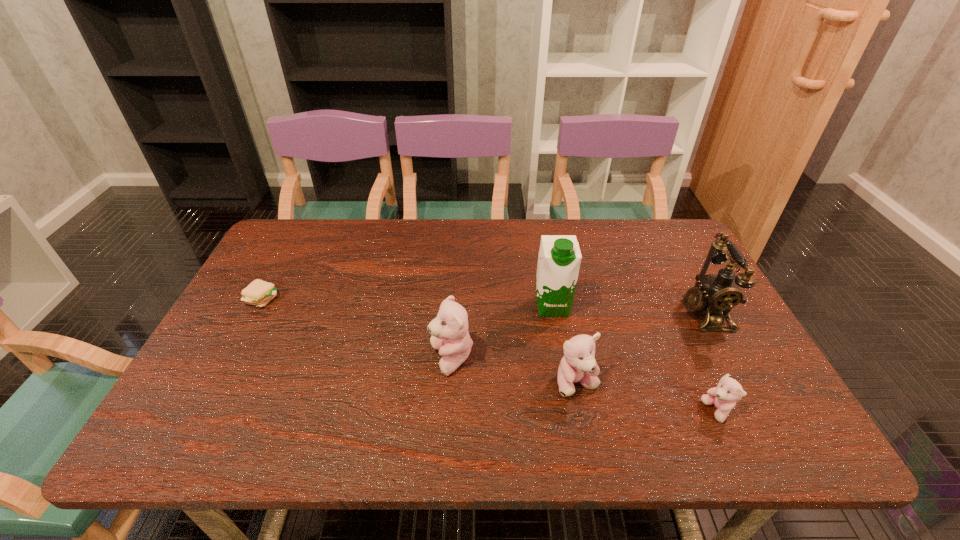
Where is `the leftmost teddy bear`? This screenshot has height=540, width=960. the leftmost teddy bear is located at coordinates (449, 330).

At what (x,y) coordinates should I click in order to perform the action: click on the second teddy bear from right to left. Please return your answer as a coordinate pair (x, y). Looking at the image, I should click on (578, 365).

At what (x,y) coordinates should I click in order to perform the action: click on the second tallest teddy bear. Please return your answer as a coordinate pair (x, y). This screenshot has width=960, height=540. Looking at the image, I should click on (578, 365).

Find the location of `the shortest teddy bear`. the shortest teddy bear is located at coordinates coord(728,391).

The height and width of the screenshot is (540, 960). I want to click on the rightmost teddy bear, so click(728, 391).

This screenshot has height=540, width=960. Find the location of `soya milk`. soya milk is located at coordinates (559, 258).

Where is `telephone`? telephone is located at coordinates (718, 294).

This screenshot has width=960, height=540. In order to click on patty in this screenshot , I will do click(x=259, y=293).

Locate an element on the screen. This screenshot has height=540, width=960. the shortest object is located at coordinates (259, 293).

Where is `vacant space located at the face of the fifth object from right to left`? vacant space located at the face of the fifth object from right to left is located at coordinates (409, 359).